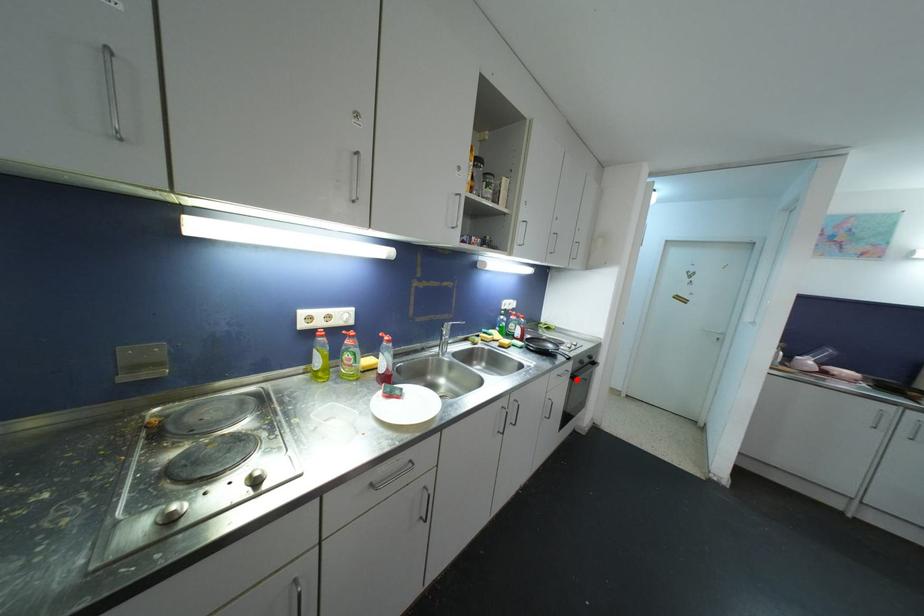
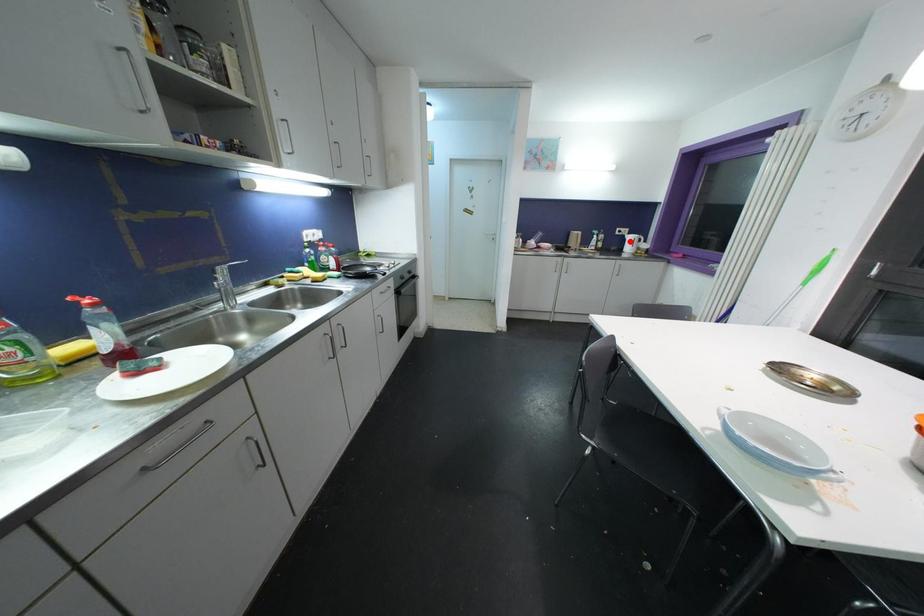
I am providing you with two images of the same scene from different viewpoints. A red point is marked on the first image and another point is marked on the second image. Do the highlighted points in image1 and image2 indicate the same real-world spot?

No